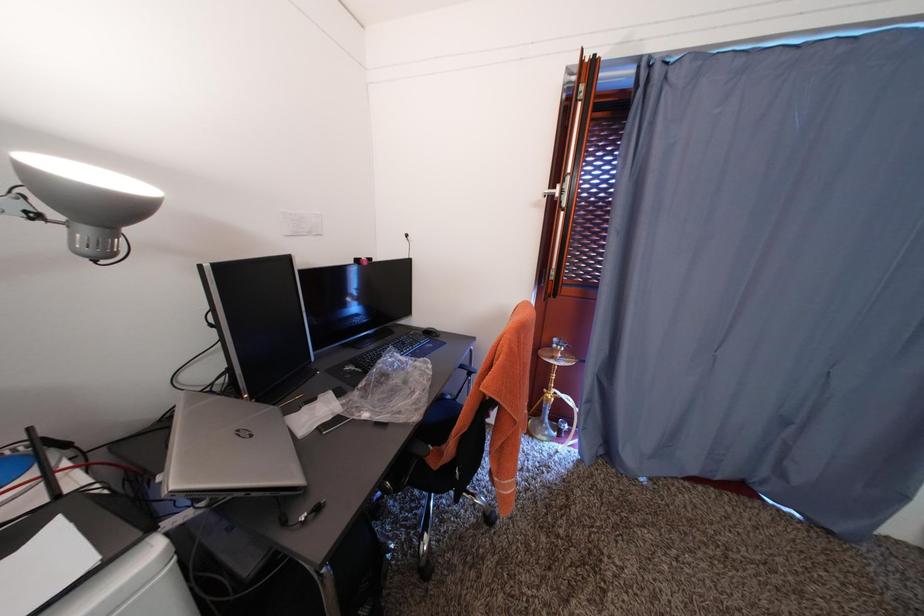
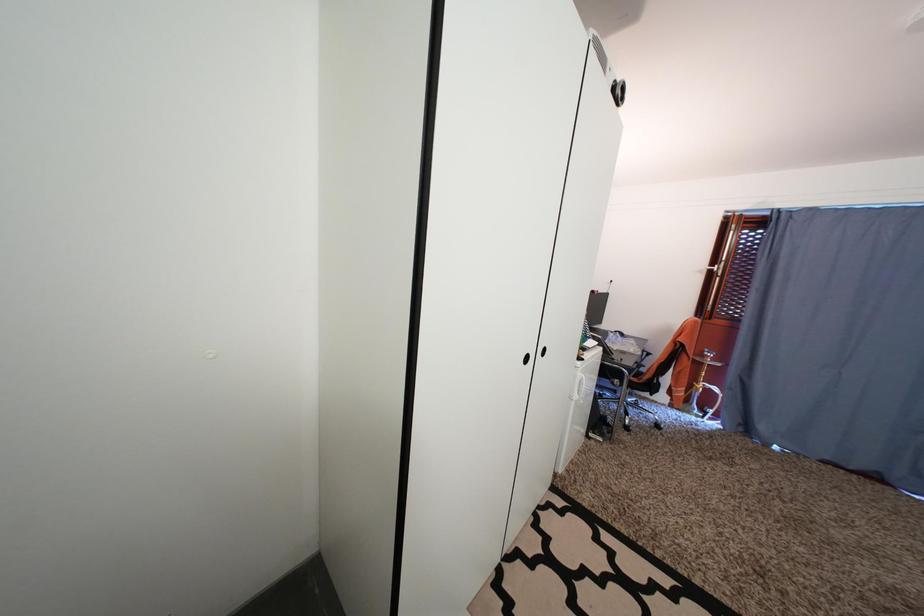
In a continuous first-person perspective shot, in which direction is the camera moving?

The cameraman moved toward left, backward.